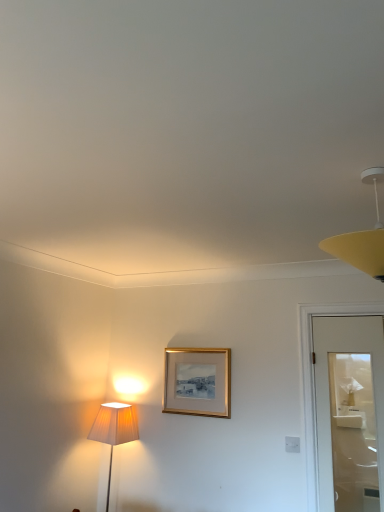
Question: Choose the correct answer: Is gold metallic picture frame at center inside yellow matte lampshade at upper right or outside it?

Choices:
 (A) inside
 (B) outside

Answer: (B)

Question: In terms of size, does gold metallic picture frame at center appear bigger or smaller than yellow matte lampshade at upper right?

Choices:
 (A) big
 (B) small

Answer: (B)

Question: Is gold metallic picture frame at center wider or thinner than yellow matte lampshade at upper right?

Choices:
 (A) wide
 (B) thin

Answer: (B)

Question: Is yellow matte lampshade at upper right taller or shorter than gold metallic picture frame at center?

Choices:
 (A) short
 (B) tall

Answer: (A)

Question: From a real-world perspective, is yellow matte lampshade at upper right positioned above or below gold metallic picture frame at center?

Choices:
 (A) below
 (B) above

Answer: (B)

Question: Is yellow matte lampshade at upper right spatially inside gold metallic picture frame at center, or outside of it?

Choices:
 (A) inside
 (B) outside

Answer: (B)

Question: From the image's perspective, is yellow matte lampshade at upper right located above or below gold metallic picture frame at center?

Choices:
 (A) above
 (B) below

Answer: (A)